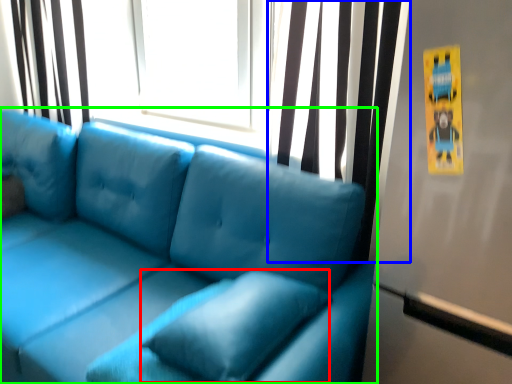
Question: Which object is the farthest from pillow (highlighted by a red box)? Choose among these: curtain (highlighted by a blue box) or studio couch (highlighted by a green box).

Choices:
 (A) curtain
 (B) studio couch

Answer: (A)